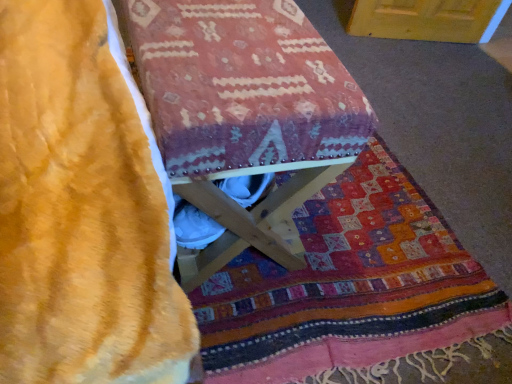
Question: Does velvety yellow blanket at lower left have a smaller size compared to wooden stool at center?

Choices:
 (A) yes
 (B) no

Answer: (A)

Question: Is velvety yellow blanket at lower left far away from wooden stool at center?

Choices:
 (A) no
 (B) yes

Answer: (A)

Question: Is velvety yellow blanket at lower left turned away from wooden stool at center?

Choices:
 (A) no
 (B) yes

Answer: (B)

Question: From the image's perspective, is velvety yellow blanket at lower left on top of wooden stool at center?

Choices:
 (A) yes
 (B) no

Answer: (B)

Question: Is velvety yellow blanket at lower left closer to the viewer compared to wooden stool at center?

Choices:
 (A) yes
 (B) no

Answer: (B)

Question: From the image's perspective, is velvety yellow blanket at lower left under wooden stool at center?

Choices:
 (A) yes
 (B) no

Answer: (A)

Question: From a real-world perspective, is wooden stool at center physically below velvety yellow blanket at lower left?

Choices:
 (A) no
 (B) yes

Answer: (A)

Question: Is wooden stool at center outside velvety yellow blanket at lower left?

Choices:
 (A) yes
 (B) no

Answer: (A)

Question: Is velvety yellow blanket at lower left surrounded by wooden stool at center?

Choices:
 (A) yes
 (B) no

Answer: (B)

Question: From the image's perspective, is wooden stool at center below velvety yellow blanket at lower left?

Choices:
 (A) no
 (B) yes

Answer: (A)

Question: From the image's perspective, is wooden stool at center on top of velvety yellow blanket at lower left?

Choices:
 (A) yes
 (B) no

Answer: (A)

Question: Does wooden stool at center have a greater width compared to velvety yellow blanket at lower left?

Choices:
 (A) no
 (B) yes

Answer: (A)

Question: Looking at the image, does wooden stool at center seem bigger or smaller compared to velvety yellow blanket at lower left?

Choices:
 (A) small
 (B) big

Answer: (B)